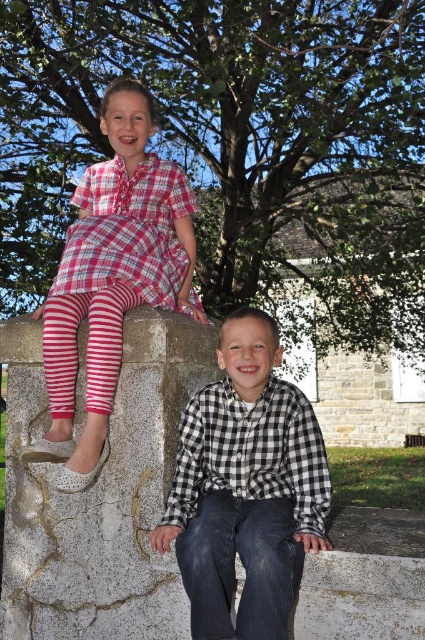
Question: Is black checkered shirt at center below plaid fabric dress at upper left?

Choices:
 (A) no
 (B) yes

Answer: (B)

Question: Which point is closer to the camera?

Choices:
 (A) (255, 572)
 (B) (323, 468)
 (C) (144, 481)
 (D) (73, 321)

Answer: (A)

Question: Is the position of gray concrete at center more distant than that of black checkered shirt at center?

Choices:
 (A) yes
 (B) no

Answer: (A)

Question: Is black checkered shirt at center behind black checkered shirt at lower center?

Choices:
 (A) yes
 (B) no

Answer: (B)

Question: Which of the following is the farthest from the observer?

Choices:
 (A) (186, 339)
 (B) (204, 576)
 (C) (226, 404)
 (D) (112, 365)

Answer: (A)

Question: Which object appears farthest from the camera in this image?

Choices:
 (A) gray concrete at center
 (B) black checkered shirt at lower center

Answer: (A)